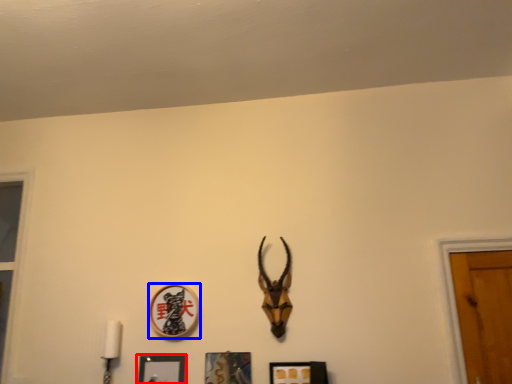
Question: Which object is further to the camera taking this photo, picture frame (highlighted by a red box) or picture frame (highlighted by a blue box)?

Choices:
 (A) picture frame
 (B) picture frame

Answer: (B)